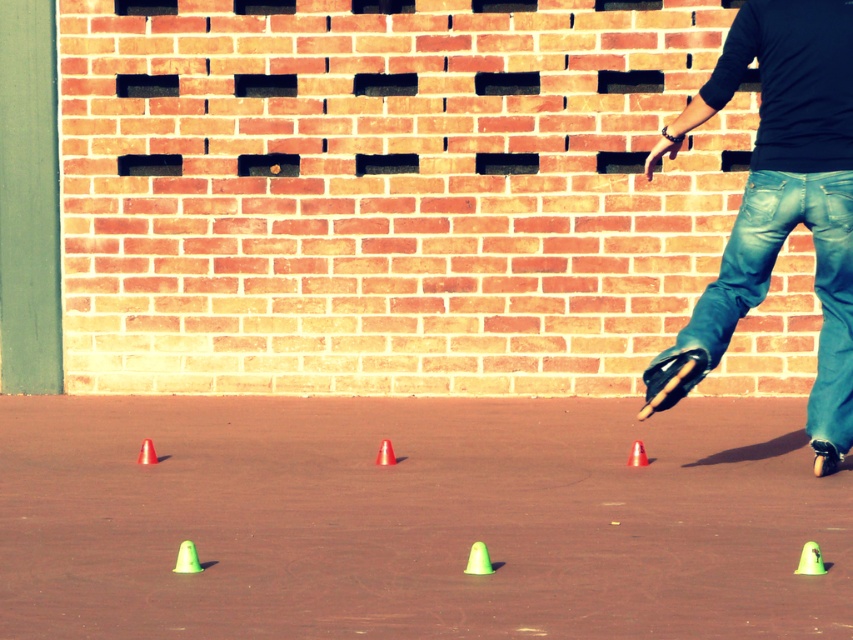
You are standing at the brick wall and want to walk towards the point marked as point (202, 608). Will you pass by point (827, 269) on your way there?

No, because point (202, 608) is in front of point (827, 269), meaning the path to the first point does not go near the second point.

You are standing at the origin point at the bottom left corner of the image. You want to move to the blue denim jeans at right. Which direction should you move in?

You should move to the right and slightly upwards to reach the blue denim jeans at right, as it is located at point 0.450 on the x axis and 0.900 on the y axis.